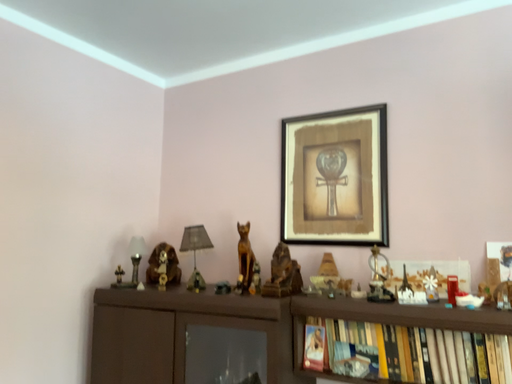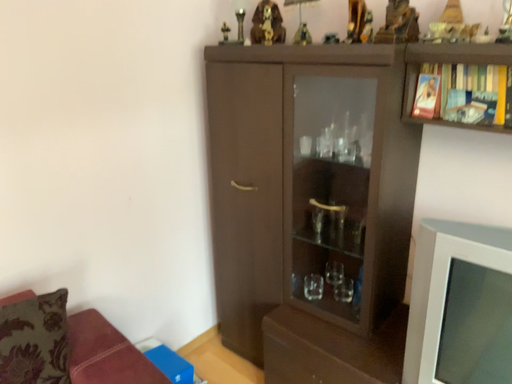
Question: How did the camera likely rotate when shooting the video?

Choices:
 (A) rotated right
 (B) rotated left

Answer: (B)